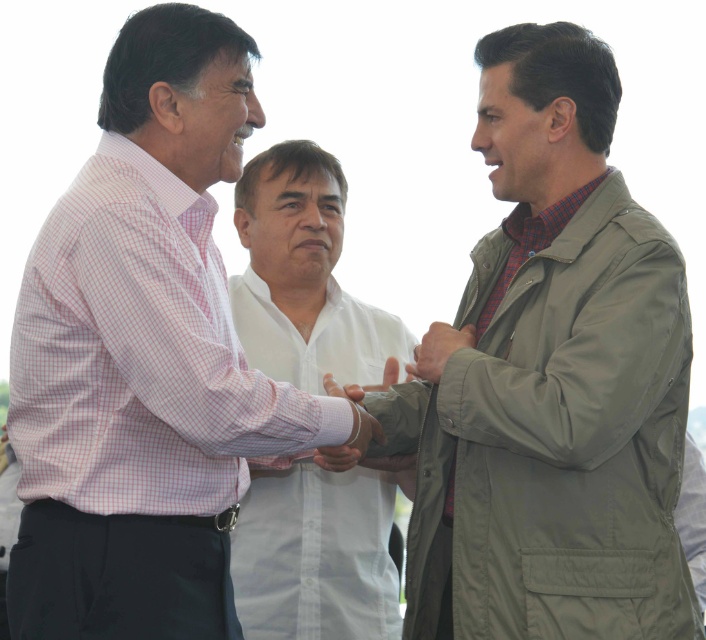
Question: Observing the image, what is the correct spatial positioning of olive green fabric trench coat at center in reference to pink checkered shirt at left?

Choices:
 (A) left
 (B) right

Answer: (B)

Question: Is pink checkered shirt at left to the right of white cotton shirt at center from the viewer's perspective?

Choices:
 (A) no
 (B) yes

Answer: (A)

Question: Which point is farther to the camera?

Choices:
 (A) olive green fabric trench coat at center
 (B) white cotton shirt at center
 (C) pink checkered shirt at left

Answer: (B)

Question: Which object is the farthest from the pink checkered shirt at left?

Choices:
 (A) olive green fabric trench coat at center
 (B) white cotton shirt at center

Answer: (B)

Question: Which of the following is the closest to the observer?

Choices:
 (A) (143, 200)
 (B) (561, 100)

Answer: (A)

Question: Can you confirm if olive green fabric trench coat at center is smaller than white cotton shirt at center?

Choices:
 (A) no
 (B) yes

Answer: (A)